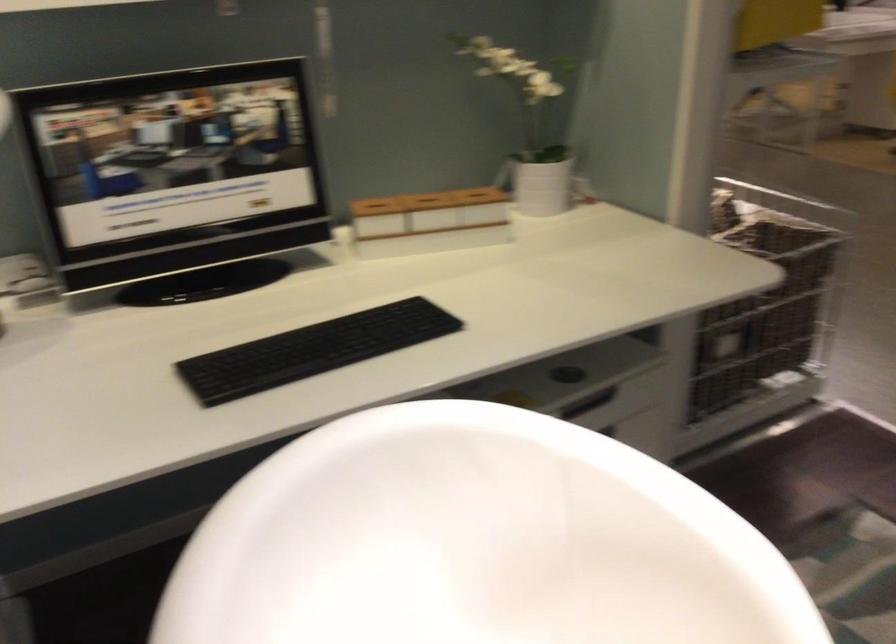
Where is `drawer handle`? The width and height of the screenshot is (896, 644). drawer handle is located at coordinates (588, 402).